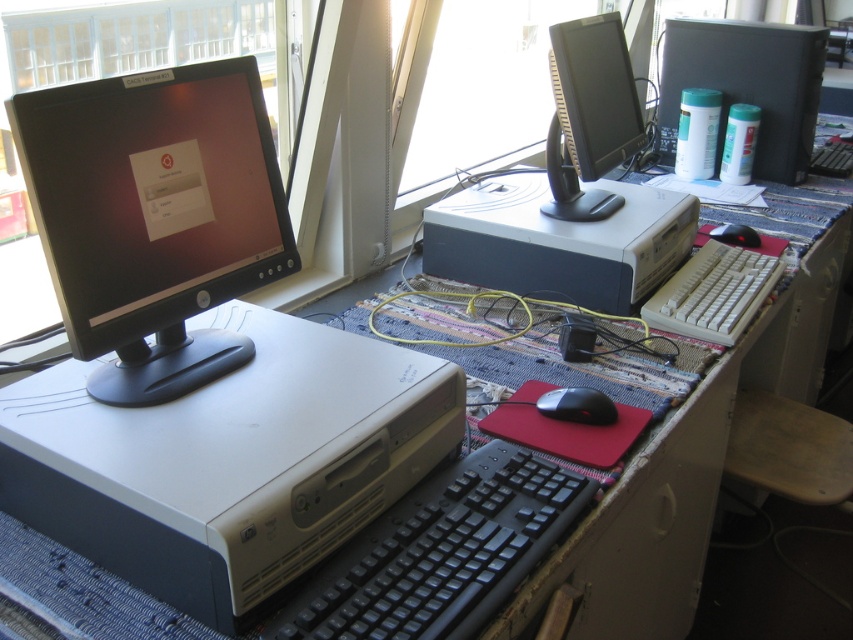
From the picture: Is black glossy monitor at left to the right of white plastic keyboard at right from the viewer's perspective?

In fact, black glossy monitor at left is to the left of white plastic keyboard at right.

Does black glossy monitor at left appear under white plastic keyboard at right?

No.

Who is more distant from viewer, (x=216, y=355) or (x=686, y=276)?

The point (x=686, y=276) is behind.

The width and height of the screenshot is (853, 640). I want to click on black glossy monitor at left, so click(x=154, y=218).

From the picture: Is gray matte desktop computer at center bigger than black rubber mouse at center?

Yes.

Is gray matte desktop computer at center shorter than black rubber mouse at center?

No.

Between point (583, 97) and point (726, 228), which one is positioned behind?

The point (726, 228) is more distant.

This screenshot has width=853, height=640. I want to click on gray matte desktop computer at center, so click(570, 195).

Who is positioned more to the right, white plastic keyboard at right or black plastic mouse at lower center?

white plastic keyboard at right is more to the right.

Who is taller, white plastic keyboard at right or black plastic mouse at lower center?

With more height is white plastic keyboard at right.

You are a GUI agent. You are given a task and a screenshot of the screen. Output one action in this format:
    pyautogui.click(x=<x>, y=<y>)
    Task: Click on the white plastic keyboard at right
    The height and width of the screenshot is (640, 853).
    Given the screenshot: What is the action you would take?
    point(712,292)